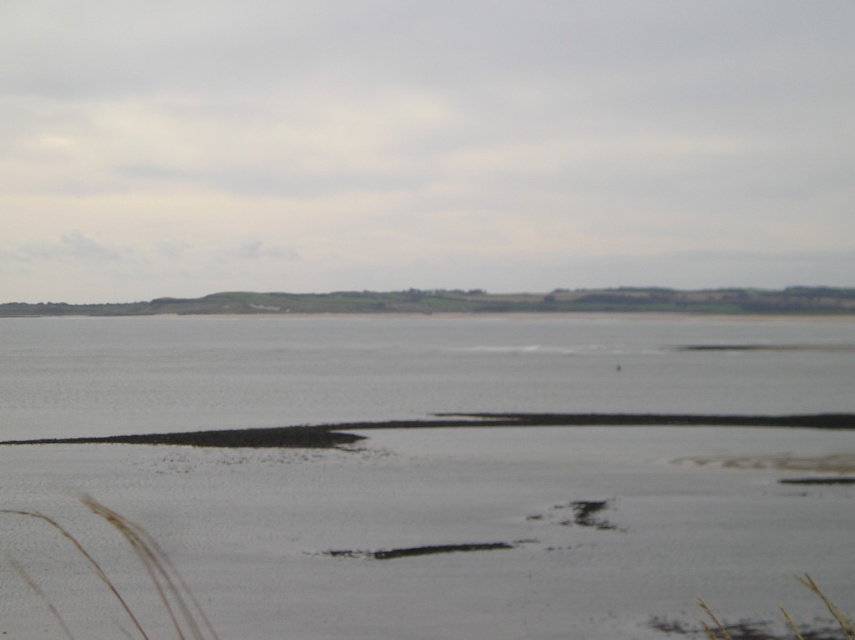
Question: Which object is closer to the camera taking this photo?

Choices:
 (A) gray matte water at center
 (B) white sandy beach at lower center

Answer: (B)

Question: Is white sandy beach at lower center further to the viewer compared to gray matte water at center?

Choices:
 (A) yes
 (B) no

Answer: (B)

Question: Which point is closer to the camera?

Choices:
 (A) gray matte water at center
 (B) white sandy beach at lower center

Answer: (B)

Question: Can you confirm if white sandy beach at lower center is positioned to the right of gray matte water at center?

Choices:
 (A) yes
 (B) no

Answer: (A)

Question: Is white sandy beach at lower center thinner than gray matte water at center?

Choices:
 (A) no
 (B) yes

Answer: (B)